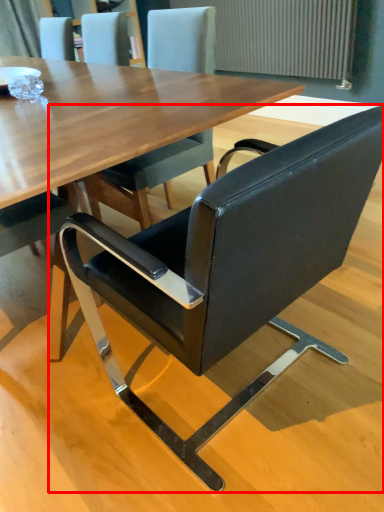
Question: From the image, what is the correct spatial relationship of chair (annotated by the red box) in relation to radiator?

Choices:
 (A) right
 (B) left

Answer: (B)